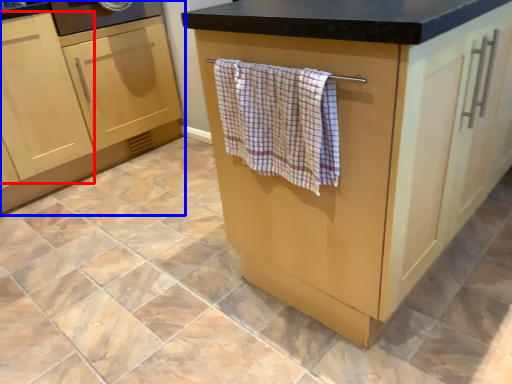
Question: Which object appears farthest to the camera in this image, cabinetry (highlighted by a red box) or cabinetry (highlighted by a blue box)?

Choices:
 (A) cabinetry
 (B) cabinetry

Answer: (B)